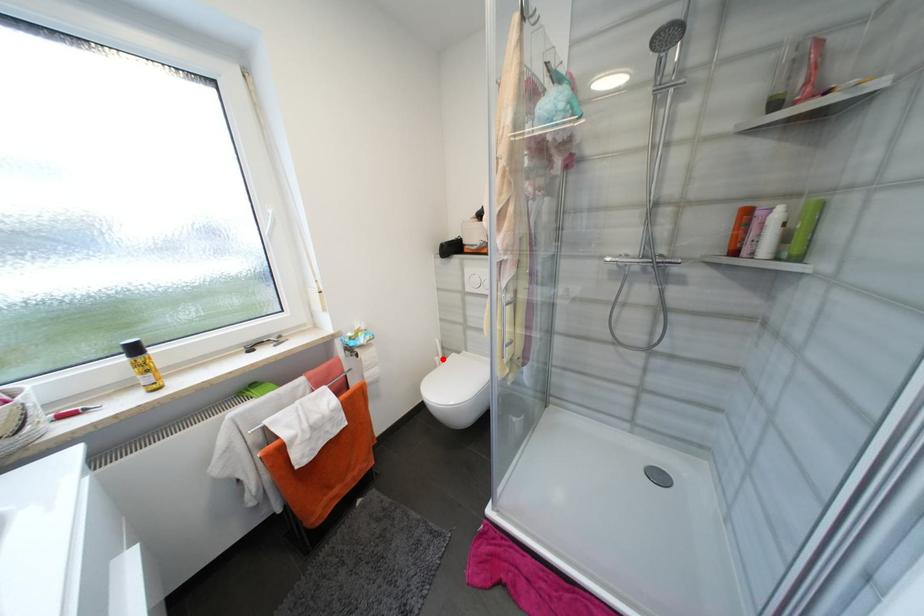
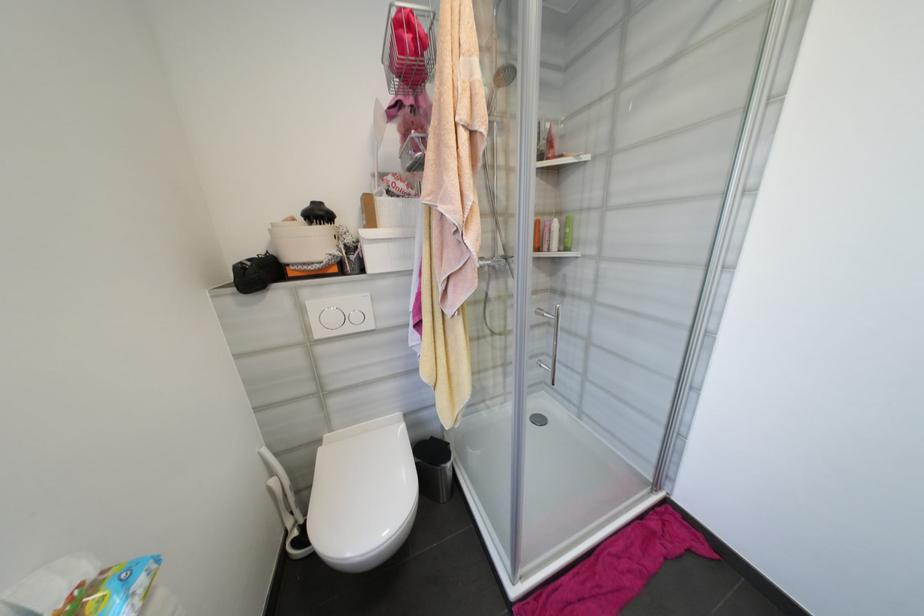
Locate, in the second image, the point that corresponds to the highlighted location in the first image.

(277, 482)